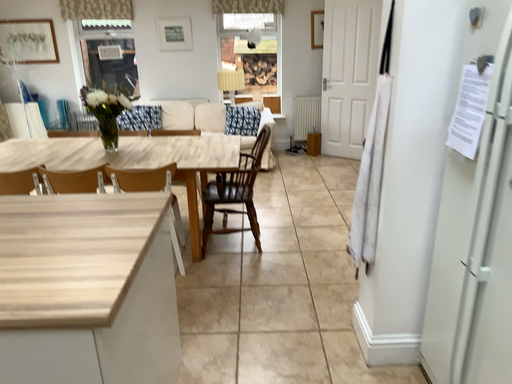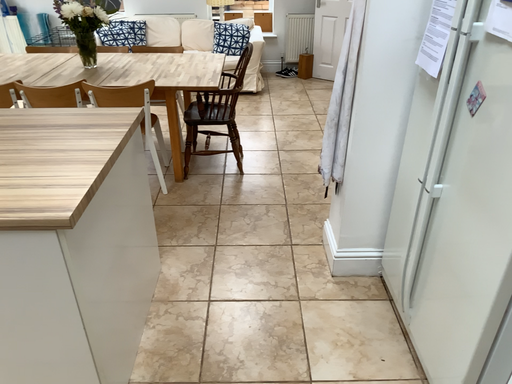
Question: How did the camera likely rotate when shooting the video?

Choices:
 (A) rotated upward
 (B) rotated downward

Answer: (B)